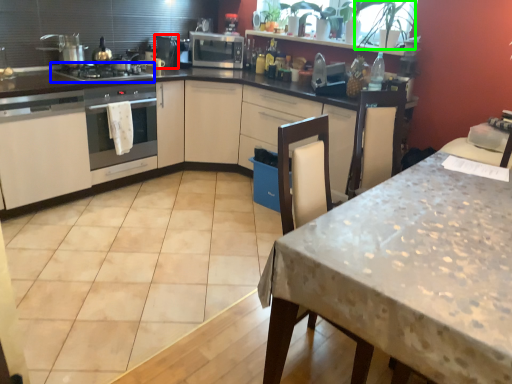
Question: Which object is positioned closest to appliance (highlighted by a red box)? Select from gas stove (highlighted by a blue box) and plant (highlighted by a green box).

Choices:
 (A) gas stove
 (B) plant

Answer: (A)